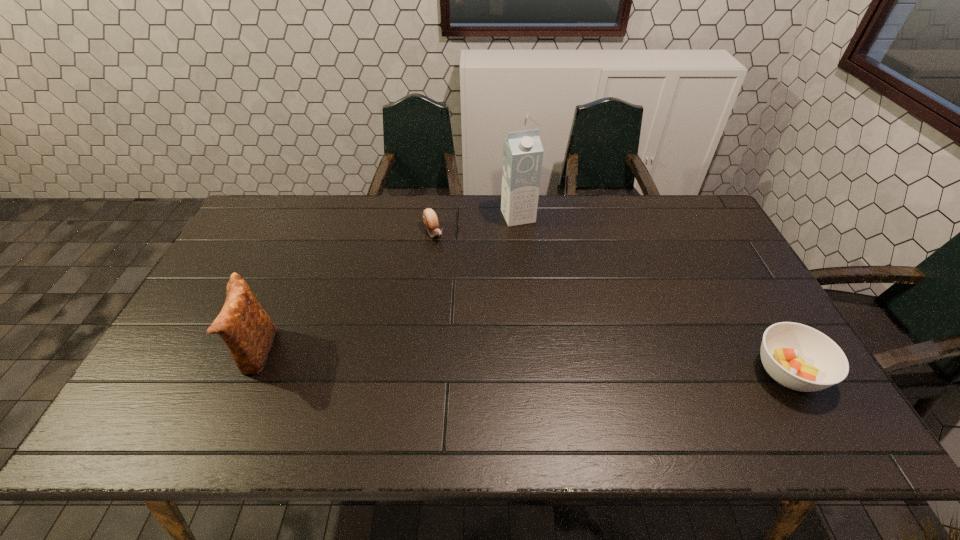
Select which object is the second closest to the tallest object. Please provide its 2D coordinates. Your answer should be formatted as a tuple, i.e. [(x, y)], where the tuple contains the x and y coordinates of a point satisfying the conditions above.

[(799, 357)]

Identify which object is the closest to the carton. Please provide its 2D coordinates. Your answer should be formatted as a tuple, i.e. [(x, y)], where the tuple contains the x and y coordinates of a point satisfying the conditions above.

[(430, 219)]

At what (x,y) coordinates should I click in order to perform the action: click on vacant area that satisfies the following two spatial constraints: 1. on the front side of the shortest object; 2. on the left side of the soup bowl. Please return your answer as a coordinate pair (x, y). Looking at the image, I should click on (418, 372).

You are a GUI agent. You are given a task and a screenshot of the screen. Output one action in this format:
    pyautogui.click(x=<x>, y=<y>)
    Task: Click on the vacant space that satisfies the following two spatial constraints: 1. on the front side of the soup bowl; 2. on the right side of the third object from left to right
    
    Given the screenshot: What is the action you would take?
    [534, 372]